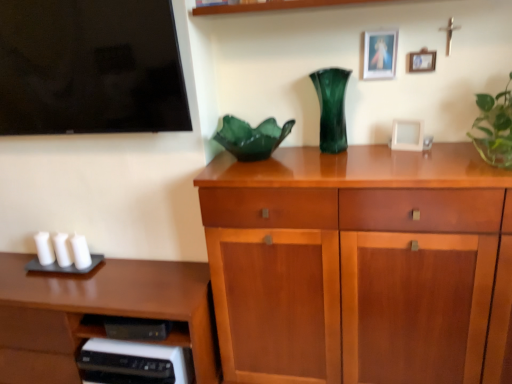
At what (x,y) coordinates should I click in order to perform the action: click on vacant space that is to the left of white matte candle at lower left, which appears as the first candle when viewed from the left. Please return your answer as a coordinate pair (x, y). The height and width of the screenshot is (384, 512). Looking at the image, I should click on (14, 259).